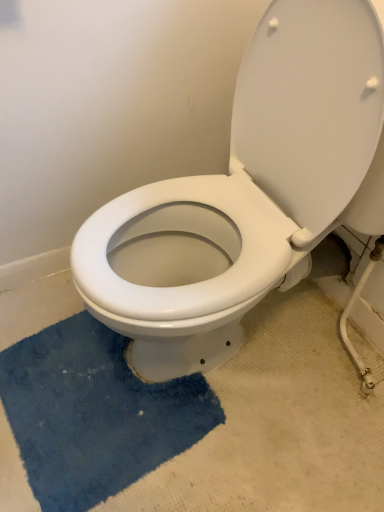
The height and width of the screenshot is (512, 384). What are the coordinates of `vacant space in white glossy toilet at center (from a real-world perspective)` in the screenshot? It's located at (241, 353).